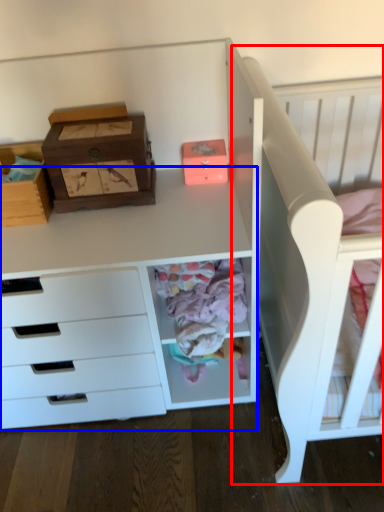
Question: Which object appears farthest to the camera in this image, bed (highlighted by a red box) or computer desk (highlighted by a blue box)?

Choices:
 (A) bed
 (B) computer desk

Answer: (B)